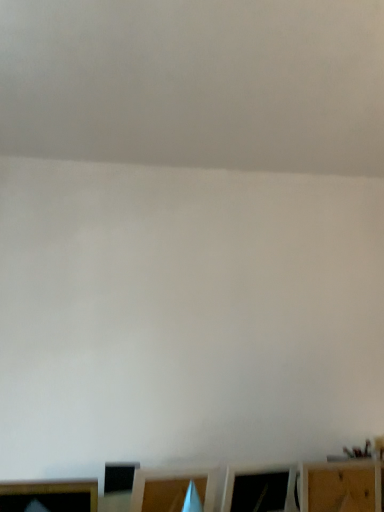
Question: From a real-world perspective, does wooden frame at lower left, the 1th furniture viewed from the left, stand above wooden shelf at lower right, which appears as the 1th furniture when viewed from the right?

Choices:
 (A) yes
 (B) no

Answer: (B)

Question: Would you consider wooden frame at lower left, marked as the second furniture in a right-to-left arrangement, to be distant from wooden shelf at lower right, the 2th furniture when ordered from left to right?

Choices:
 (A) yes
 (B) no

Answer: (B)

Question: Is wooden frame at lower left, the 1th furniture viewed from the left, wider than wooden shelf at lower right, which appears as the 1th furniture when viewed from the right?

Choices:
 (A) yes
 (B) no

Answer: (A)

Question: Does wooden frame at lower left, marked as the second furniture in a right-to-left arrangement, turn towards wooden shelf at lower right, which appears as the 1th furniture when viewed from the right?

Choices:
 (A) no
 (B) yes

Answer: (A)

Question: Is the position of wooden frame at lower left, the 1th furniture viewed from the left, less distant than that of wooden shelf at lower right, which appears as the 1th furniture when viewed from the right?

Choices:
 (A) yes
 (B) no

Answer: (A)

Question: Would you say wooden shelf at lower right, the 2th furniture when ordered from left to right, is part of wooden frame at lower left, marked as the second furniture in a right-to-left arrangement,'s contents?

Choices:
 (A) no
 (B) yes

Answer: (A)

Question: Is wooden shelf at lower right, the 2th furniture when ordered from left to right, thinner than wooden frame at lower left, the 1th furniture viewed from the left?

Choices:
 (A) no
 (B) yes

Answer: (B)

Question: Is wooden shelf at lower right, the 2th furniture when ordered from left to right, wider than wooden frame at lower left, the 1th furniture viewed from the left?

Choices:
 (A) no
 (B) yes

Answer: (A)

Question: Is wooden shelf at lower right, the 2th furniture when ordered from left to right, positioned beyond the bounds of wooden frame at lower left, the 1th furniture viewed from the left?

Choices:
 (A) yes
 (B) no

Answer: (A)

Question: Is wooden shelf at lower right, which appears as the 1th furniture when viewed from the right, behind wooden frame at lower left, the 1th furniture viewed from the left?

Choices:
 (A) no
 (B) yes

Answer: (B)

Question: Is wooden shelf at lower right, which appears as the 1th furniture when viewed from the right, far away from wooden frame at lower left, the 1th furniture viewed from the left?

Choices:
 (A) yes
 (B) no

Answer: (B)

Question: Considering the relative sizes of wooden shelf at lower right, which appears as the 1th furniture when viewed from the right, and wooden frame at lower left, marked as the second furniture in a right-to-left arrangement, in the image provided, is wooden shelf at lower right, which appears as the 1th furniture when viewed from the right, shorter than wooden frame at lower left, marked as the second furniture in a right-to-left arrangement,?

Choices:
 (A) no
 (B) yes

Answer: (A)

Question: Is wooden shelf at lower right, the 2th furniture when ordered from left to right, spatially inside wooden frame at lower left, marked as the second furniture in a right-to-left arrangement, or outside of it?

Choices:
 (A) outside
 (B) inside

Answer: (A)